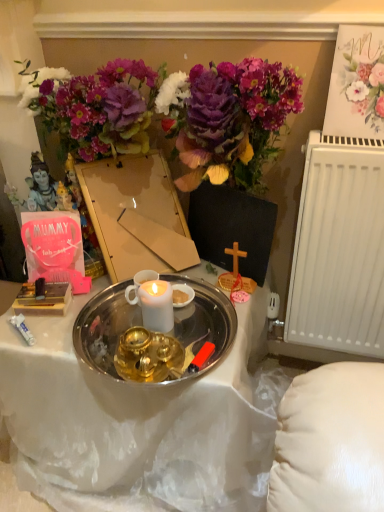
The height and width of the screenshot is (512, 384). What are the coordinates of `free space above metallic tray at center (from a real-world perspective)` in the screenshot? It's located at (139, 307).